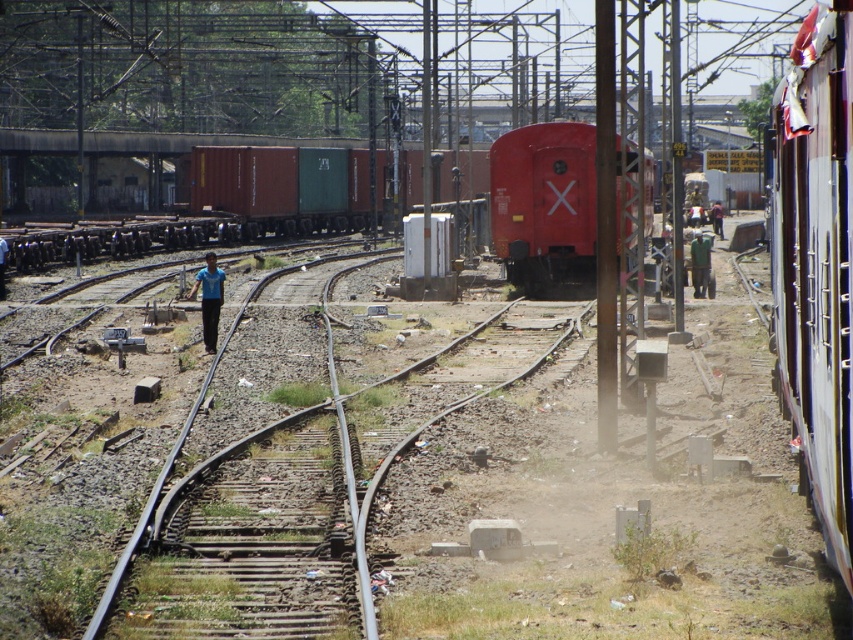
Question: Is metallic silver train at right to the left of green matte shirt at center from the viewer's perspective?

Choices:
 (A) no
 (B) yes

Answer: (A)

Question: Can you confirm if green matte container at center is bigger than blue fabric shirt at center?

Choices:
 (A) no
 (B) yes

Answer: (B)

Question: Among these objects, which one is nearest to the camera?

Choices:
 (A) blue shirt at center
 (B) green matte shirt at center
 (C) blue shirt at left
 (D) metallic silver train at right

Answer: (D)

Question: Which object is closer to the camera taking this photo?

Choices:
 (A) metallic silver train at right
 (B) metal at left
 (C) blue shirt at center

Answer: (A)

Question: Does smooth red train at center come in front of blue shirt at left?

Choices:
 (A) no
 (B) yes

Answer: (B)

Question: Which point is farther to the camera?

Choices:
 (A) metallic silver train at right
 (B) metal at left
 (C) smooth red train at center
 (D) blue fabric shirt at center

Answer: (D)